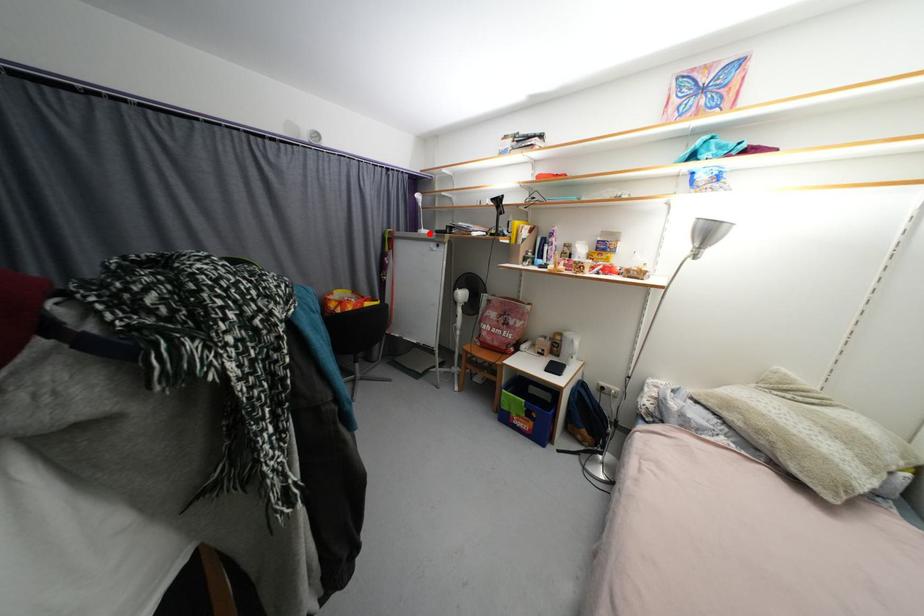
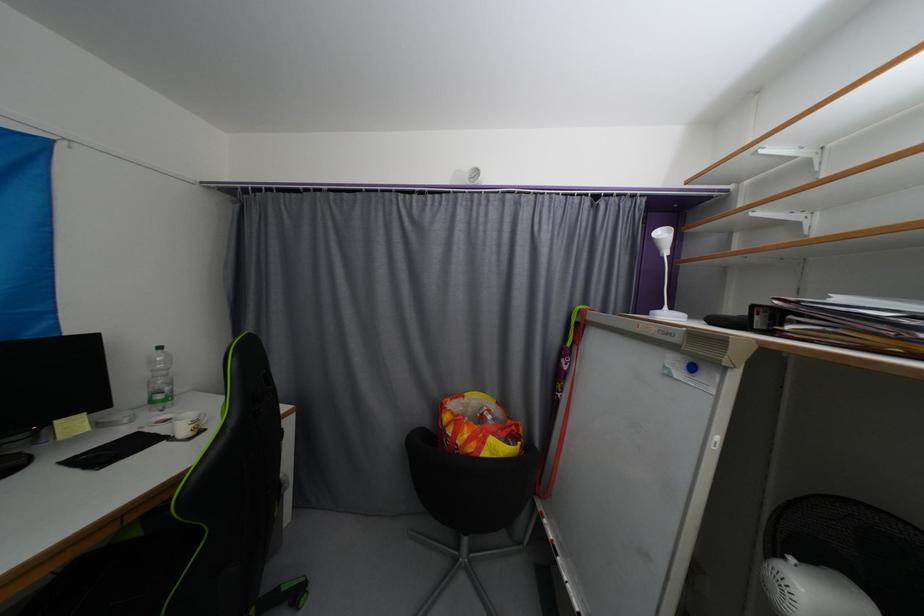
Question: I am providing you with two images of the same scene from different viewpoints. A red point is shown in image1. For the corresponding object point in image2, is it positioned nearer or farther from the camera?

Choices:
 (A) Nearer
 (B) Farther

Answer: (B)